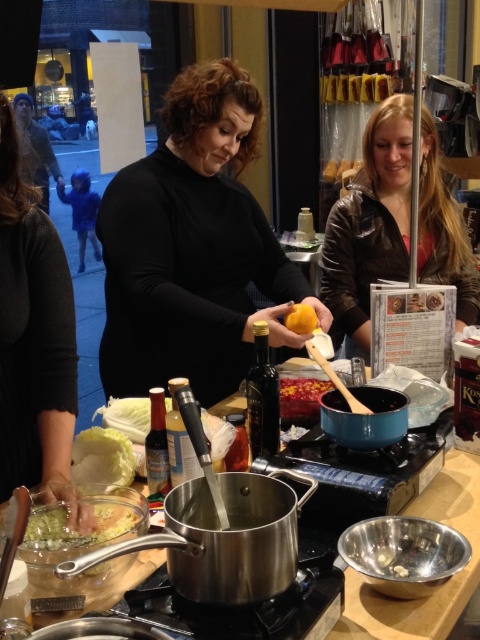
Question: Is stainless steel pot at center above yellow matte orange at center?

Choices:
 (A) yes
 (B) no

Answer: (B)

Question: Which point is closer to the camera?

Choices:
 (A) (444, 241)
 (B) (294, 417)
 (C) (81, 480)
 (D) (300, 280)

Answer: (C)

Question: Does matte black sweater at center lie in front of dark gray sweater at left?

Choices:
 (A) no
 (B) yes

Answer: (A)

Question: Is stainless steel pot at center smaller than smooth red sauce at center?

Choices:
 (A) no
 (B) yes

Answer: (A)

Question: Which point is farther to the camera?

Choices:
 (A) yellow matte orange at center
 (B) smooth red sauce at center
 (C) matte black sweater at center
 (D) dark gray sweater at left

Answer: (C)

Question: Which object is positioned farthest from the brown leather jacket at upper right?

Choices:
 (A) yellow matte orange at center
 (B) matte black sweater at center
 (C) translucent plastic container at lower left

Answer: (C)